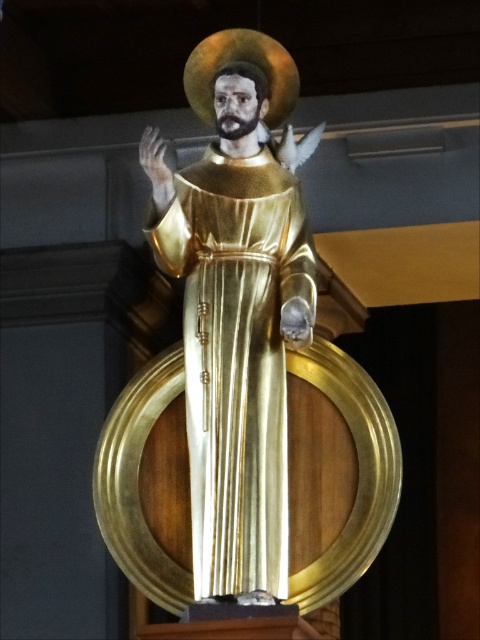
Can you confirm if gold polished statue at center is positioned above gold shiny dress at center?

No, gold polished statue at center is not above gold shiny dress at center.

Can you confirm if gold polished statue at center is positioned to the left of gold shiny dress at center?

Incorrect, gold polished statue at center is not on the left side of gold shiny dress at center.

Does point (385, 518) come closer to viewer compared to point (266, 573)?

No.

Find the location of a particular element. gold polished statue at center is located at coordinates (244, 378).